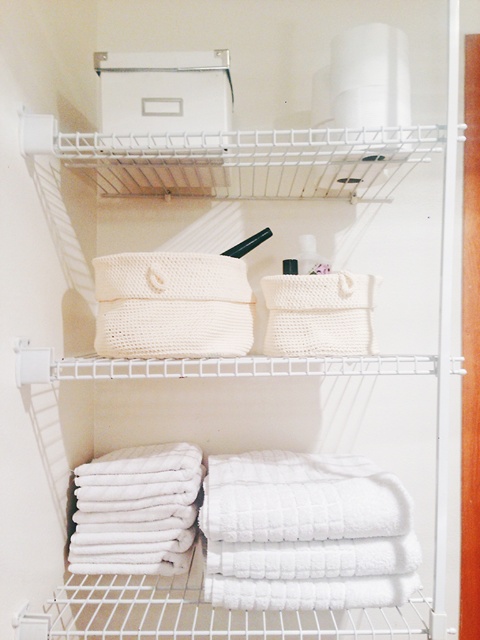
Question: Which point is closer to the camera?

Choices:
 (A) white plastic toiletries at center
 (B) matte black toiletry at center

Answer: (A)

Question: Which point is farther from the camera taking this photo?

Choices:
 (A) (303, 260)
 (B) (286, 269)

Answer: (A)

Question: Does white plastic toiletries at center have a lesser width compared to matte black toiletry at center?

Choices:
 (A) yes
 (B) no

Answer: (B)

Question: Is white plastic toiletries at center further to the viewer compared to matte black toiletry at center?

Choices:
 (A) no
 (B) yes

Answer: (A)

Question: Does white plastic toiletries at center appear on the left side of matte black toiletry at center?

Choices:
 (A) yes
 (B) no

Answer: (B)

Question: Among these objects, which one is nearest to the camera?

Choices:
 (A) white plastic toiletries at center
 (B) matte black toiletry at center

Answer: (A)